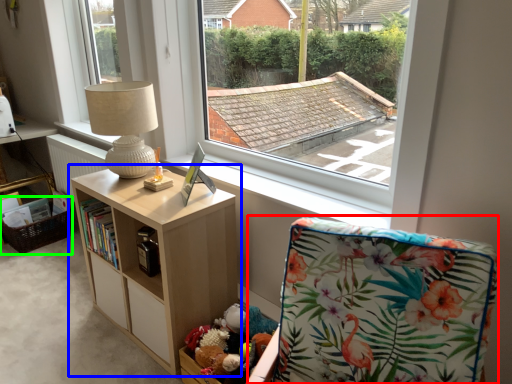
Question: Considering the real-world distances, which object is closest to rocking chair (highlighted by a red box)? shelf (highlighted by a blue box) or basket (highlighted by a green box).

Choices:
 (A) shelf
 (B) basket

Answer: (A)